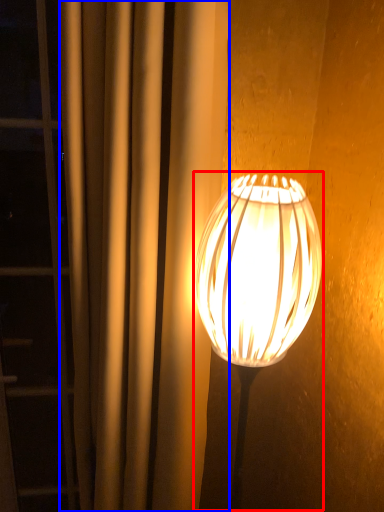
Question: Which of the following is the closest to the observer, lamp (highlighted by a red box) or curtain (highlighted by a blue box)?

Choices:
 (A) lamp
 (B) curtain

Answer: (A)